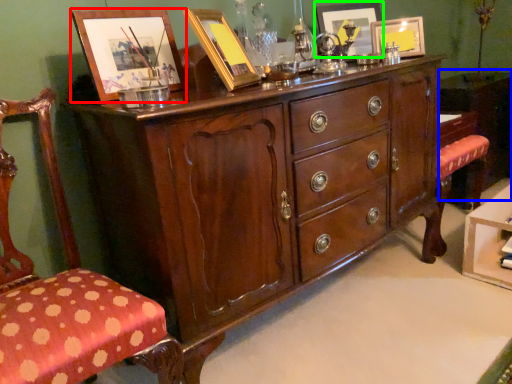
Question: Considering the real-world distances, which object is farthest from picture frame (highlighted by a red box)? vanity (highlighted by a blue box) or picture frame (highlighted by a green box)?

Choices:
 (A) vanity
 (B) picture frame

Answer: (A)